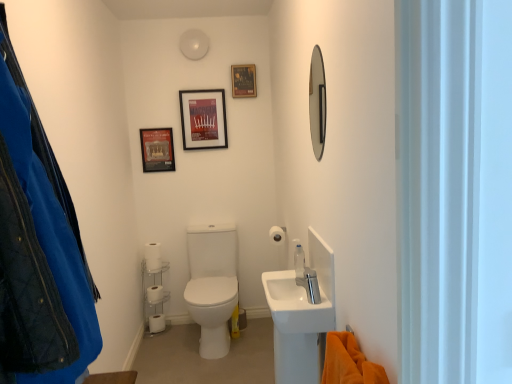
I want to click on free location in front of white plastic shelf at lower left, so click(153, 339).